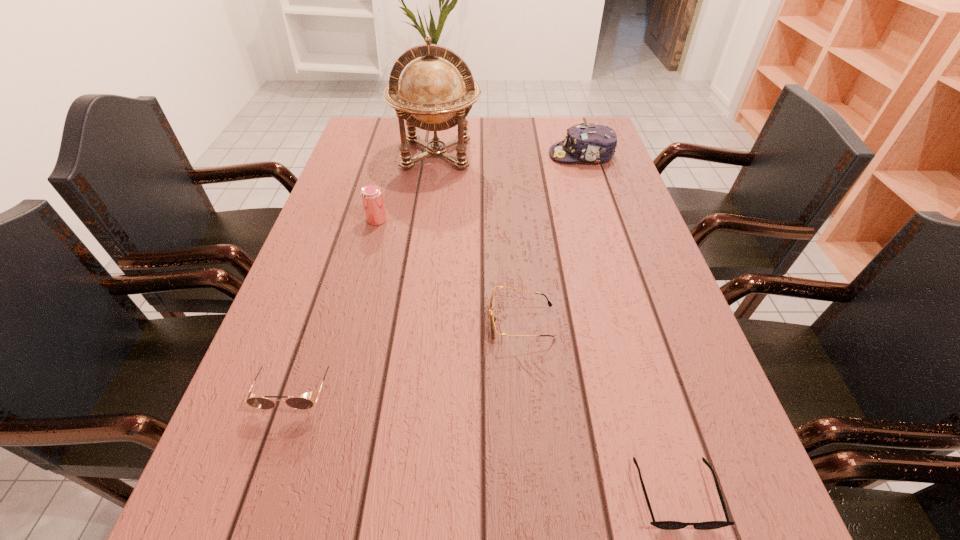
Image resolution: width=960 pixels, height=540 pixels. What are the coordinates of `globe` in the screenshot? It's located at (431, 95).

Locate an element on the screen. The height and width of the screenshot is (540, 960). headwear is located at coordinates (596, 143).

Where is `the fourth nearest object`? Image resolution: width=960 pixels, height=540 pixels. the fourth nearest object is located at coordinates (372, 197).

Locate an element on the screen. the third shortest object is located at coordinates (300, 403).

Find the location of a particular element. the second nearest sunglasses is located at coordinates (300, 403).

This screenshot has height=540, width=960. Identify the location of the second tallest sunglasses. (492, 319).

The image size is (960, 540). Identify the location of the farthest sunglasses. (492, 319).

This screenshot has width=960, height=540. What are the coordinates of `the nearest sunglasses` in the screenshot? It's located at (666, 525).

The height and width of the screenshot is (540, 960). I want to click on the nearest object, so click(666, 525).

The width and height of the screenshot is (960, 540). What are the coordinates of `free location located 0.290m on the front-facing side of the tallest object` in the screenshot? It's located at (425, 243).